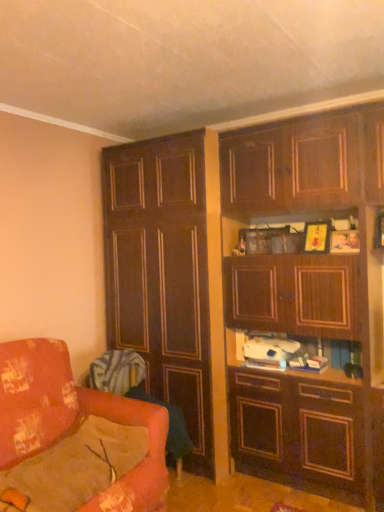
Question: Is dark wood cabinet at left, the first cabinetry in the left-to-right sequence, at the left side of floral fabric couch at lower left?

Choices:
 (A) no
 (B) yes

Answer: (A)

Question: Is dark wood cabinet at left, the first cabinetry in the left-to-right sequence, in contact with floral fabric couch at lower left?

Choices:
 (A) yes
 (B) no

Answer: (B)

Question: Is the depth of dark wood cabinet at left, positioned as the 2th cabinetry in right-to-left order, greater than that of floral fabric couch at lower left?

Choices:
 (A) yes
 (B) no

Answer: (A)

Question: From a real-world perspective, is dark wood cabinet at left, positioned as the 2th cabinetry in right-to-left order, positioned under floral fabric couch at lower left based on gravity?

Choices:
 (A) yes
 (B) no

Answer: (B)

Question: From the image's perspective, is dark wood cabinet at left, positioned as the 2th cabinetry in right-to-left order, on top of floral fabric couch at lower left?

Choices:
 (A) no
 (B) yes

Answer: (B)

Question: Is dark wood cabinet at left, the first cabinetry in the left-to-right sequence, positioned with its back to floral fabric couch at lower left?

Choices:
 (A) yes
 (B) no

Answer: (B)

Question: Does velvet orange swivel chair at lower left, the second swivel chair from the top, turn towards dark wood cabinet at left, positioned as the 2th cabinetry in right-to-left order?

Choices:
 (A) no
 (B) yes

Answer: (A)

Question: From a real-world perspective, is velvet orange swivel chair at lower left, the second swivel chair from the top, located higher than dark wood cabinet at left, the first cabinetry in the left-to-right sequence?

Choices:
 (A) no
 (B) yes

Answer: (A)

Question: From the image's perspective, is velvet orange swivel chair at lower left, the second swivel chair from the top, located above dark wood cabinet at left, positioned as the 2th cabinetry in right-to-left order?

Choices:
 (A) yes
 (B) no

Answer: (B)

Question: Are velvet orange swivel chair at lower left, acting as the 1th swivel chair starting from the bottom, and dark wood cabinet at left, the first cabinetry in the left-to-right sequence, making contact?

Choices:
 (A) yes
 (B) no

Answer: (B)

Question: Is velvet orange swivel chair at lower left, the second swivel chair from the top, shorter than dark wood cabinet at left, the first cabinetry in the left-to-right sequence?

Choices:
 (A) yes
 (B) no

Answer: (A)

Question: Does velvet orange swivel chair at lower left, acting as the 1th swivel chair starting from the bottom, have a smaller size compared to dark wood cabinet at left, the first cabinetry in the left-to-right sequence?

Choices:
 (A) yes
 (B) no

Answer: (A)

Question: Does velvet orange swivel chair at lower left, arranged as the 1th swivel chair when viewed from the top, turn towards wooden cabinet at upper right, which ranks as the second cabinetry in left-to-right order?

Choices:
 (A) no
 (B) yes

Answer: (A)